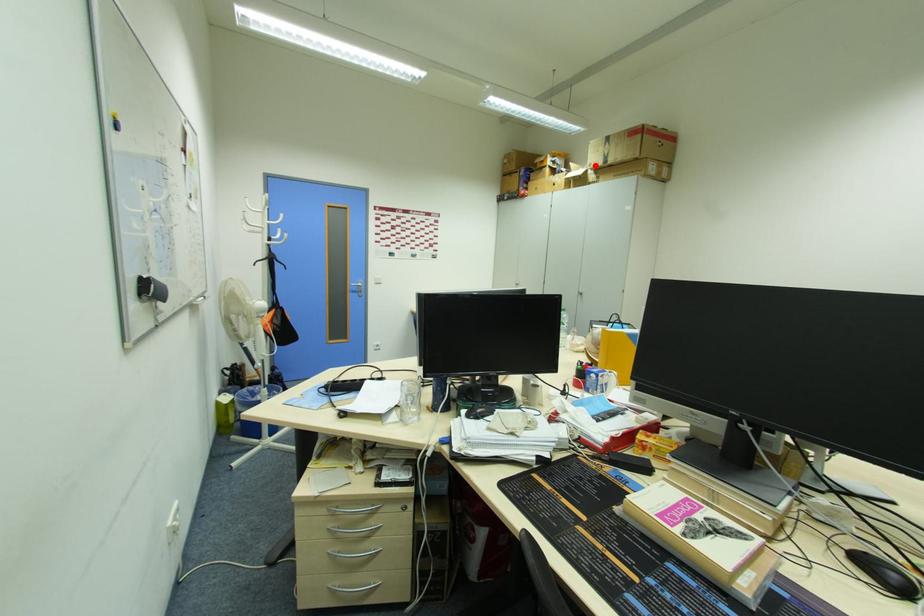
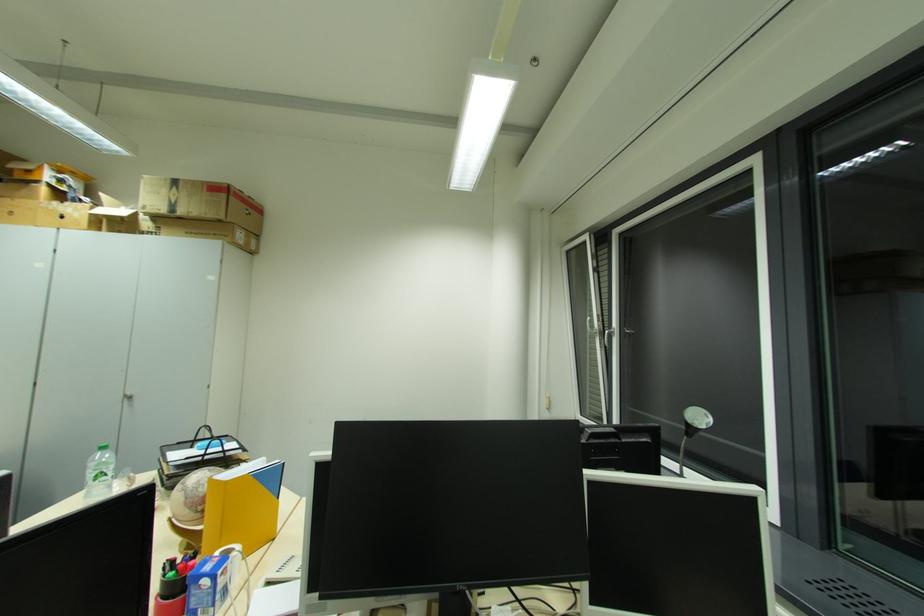
Where in the second image is the point corresponding to the highlighted location from the first image?

(152, 209)